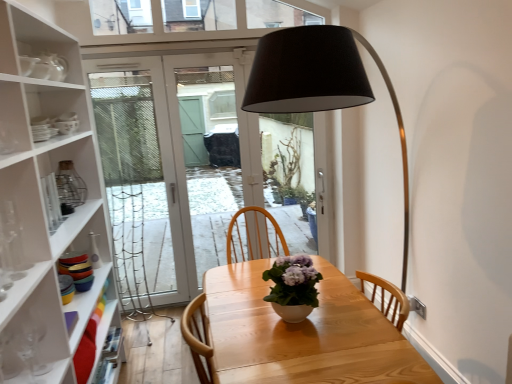
Question: Is light wood table at center surrounded by white glossy vase at center?

Choices:
 (A) no
 (B) yes

Answer: (A)

Question: Is the position of white glossy vase at center less distant than that of light wood table at center?

Choices:
 (A) no
 (B) yes

Answer: (A)

Question: From the image's perspective, is white glossy vase at center beneath light wood table at center?

Choices:
 (A) no
 (B) yes

Answer: (A)

Question: From a real-world perspective, is white glossy vase at center under light wood table at center?

Choices:
 (A) no
 (B) yes

Answer: (A)

Question: Considering the relative sizes of white glossy vase at center and light wood table at center in the image provided, is white glossy vase at center shorter than light wood table at center?

Choices:
 (A) no
 (B) yes

Answer: (B)

Question: From the image's perspective, does white glossy vase at center appear higher than light wood table at center?

Choices:
 (A) no
 (B) yes

Answer: (B)

Question: Is matte white door at center not inside clear glass vase at left?

Choices:
 (A) no
 (B) yes

Answer: (B)

Question: Is there a large distance between matte white door at center and clear glass vase at left?

Choices:
 (A) yes
 (B) no

Answer: (A)

Question: Is matte white door at center in front of clear glass vase at left?

Choices:
 (A) no
 (B) yes

Answer: (A)

Question: Can you confirm if matte white door at center is thinner than clear glass vase at left?

Choices:
 (A) yes
 (B) no

Answer: (A)

Question: Is the depth of matte white door at center greater than that of clear glass vase at left?

Choices:
 (A) yes
 (B) no

Answer: (A)

Question: Is matte white door at center smaller than clear glass vase at left?

Choices:
 (A) no
 (B) yes

Answer: (A)

Question: Can you confirm if matte white door at center is taller than white glossy vase at center?

Choices:
 (A) yes
 (B) no

Answer: (A)